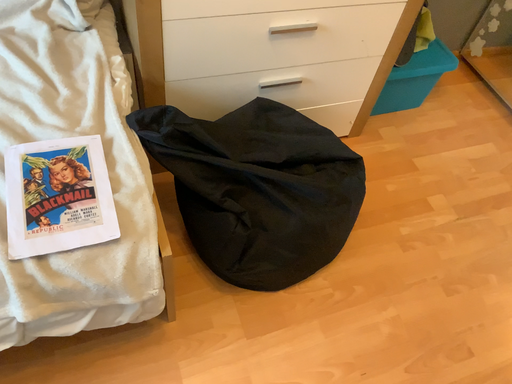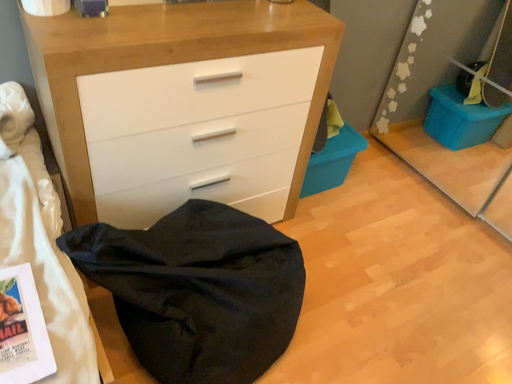
Question: Which way did the camera rotate in the video?

Choices:
 (A) rotated upward
 (B) rotated downward

Answer: (A)